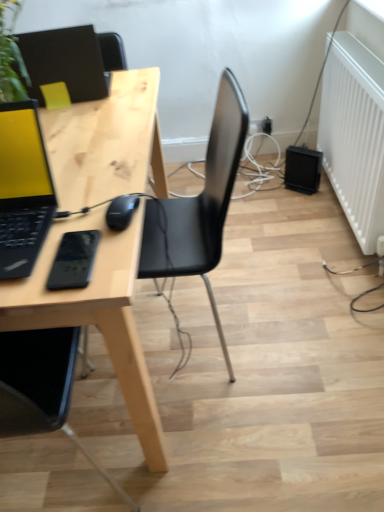
Locate an element on the screen. vacant space to the right of matte black laptop at left, which appears as the first laptop when viewed from the front is located at coordinates (98, 217).